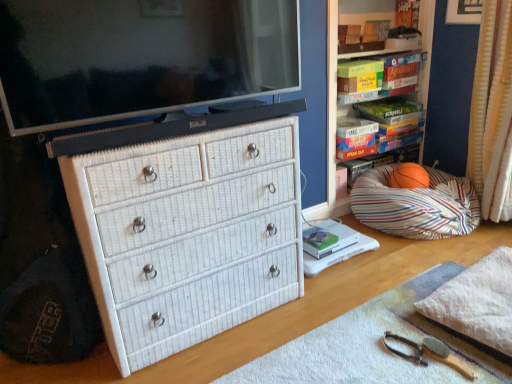
The height and width of the screenshot is (384, 512). What do you see at coordinates (361, 56) in the screenshot?
I see `striped fabric bean bag at right` at bounding box center [361, 56].

Where is `hardcover book at center, which appears as the first book when ordered from the bottom`? This screenshot has height=384, width=512. hardcover book at center, which appears as the first book when ordered from the bottom is located at coordinates (319, 238).

At what (x,y) coordinates should I click in order to perform the action: click on white fluffy blanket at lower right. Please return your answer as a coordinate pair (x, y). The width and height of the screenshot is (512, 384). Looking at the image, I should click on (478, 299).

The image size is (512, 384). Describe the element at coordinates (359, 82) in the screenshot. I see `hardcover book at upper right, positioned as the 1th book in top-to-bottom order` at that location.

What are the coordinates of `matte black flat-screen tv at upper center` in the screenshot? It's located at pos(139,57).

Is striped fabric bean bag at right not close to striped fabric bean bag at right?

No, striped fabric bean bag at right is not far away from striped fabric bean bag at right.

From a real-world perspective, is striped fabric bean bag at right below striped fabric bean bag at right?

Actually, striped fabric bean bag at right is physically above striped fabric bean bag at right in the real world.

Is striped fabric bean bag at right facing towards striped fabric bean bag at right?

Yes.

From the picture: Is striped fabric bean bag at right bigger than striped fabric bean bag at right?

Yes.

Does point (327, 244) come farther from viewer compared to point (466, 353)?

Yes, point (327, 244) is farther from viewer.

From the image's perspective, which is above, hardcover book at center, the first book from the front, or white wicker chest at center?

hardcover book at center, the first book from the front, appears higher in the image.

In terms of width, does hardcover book at center, which is the second book from top to bottom, look wider or thinner when compared to white wicker chest at center?

hardcover book at center, which is the second book from top to bottom, is thinner than white wicker chest at center.

Is hardcover book at center, the second book in the back-to-front sequence, taller than white wicker chest at center?

No, hardcover book at center, the second book in the back-to-front sequence, is not taller than white wicker chest at center.

From their relative heights in the image, would you say hardcover book at upper right, the 1th book when ordered from right to left, is taller or shorter than white wicker chest of drawers at left?

In the image, hardcover book at upper right, the 1th book when ordered from right to left, appears to be shorter than white wicker chest of drawers at left.

Does hardcover book at upper right, which appears as the second book when ordered from the bottom, have a smaller size compared to white wicker chest of drawers at left?

Yes.

Can white wicker chest of drawers at left be found inside hardcover book at upper right, acting as the 1th book starting from the back?

No, white wicker chest of drawers at left is not a part of hardcover book at upper right, acting as the 1th book starting from the back.

Considering the sizes of objects hardcover book at upper right, which appears as the second book when ordered from the bottom, and white wicker chest of drawers at left in the image provided, who is wider, hardcover book at upper right, which appears as the second book when ordered from the bottom, or white wicker chest of drawers at left?

white wicker chest of drawers at left.

The width and height of the screenshot is (512, 384). In order to click on chest of drawers above the striped fabric bean bag at right (from a real-world perspective) in this screenshot , I will do `click(188, 234)`.

Does point (291, 287) come behind point (465, 200)?

That is False.

Is white wicker chest of drawers at left aimed at striped fabric bean bag at right?

No, white wicker chest of drawers at left is not aimed at striped fabric bean bag at right.

Is white wicker chest of drawers at left further to camera compared to striped fabric bean bag at right?

No, white wicker chest of drawers at left is closer to the camera.

Is there a large distance between white fluffy blanket at lower right and striped fabric bean bag at right?

Actually, white fluffy blanket at lower right and striped fabric bean bag at right are a little close together.

In the scene shown: Could you tell me if white fluffy blanket at lower right is turned towards striped fabric bean bag at right?

No.

Does white fluffy blanket at lower right lie behind striped fabric bean bag at right?

No, white fluffy blanket at lower right is in front of striped fabric bean bag at right.

Between point (507, 341) and point (393, 216), which one is positioned behind?

The point (393, 216) is more distant.

In the image, is white wicker chest of drawers at left on the left side or the right side of white textured curtain at right?

white wicker chest of drawers at left is to the left of white textured curtain at right.

From a real-world perspective, is white wicker chest of drawers at left positioned over white textured curtain at right based on gravity?

Incorrect, from a real-world perspective, white wicker chest of drawers at left is lower than white textured curtain at right.

Is white wicker chest of drawers at left not within white textured curtain at right?

white wicker chest of drawers at left is positioned outside white textured curtain at right.

Which of these two, white wicker chest of drawers at left or white textured curtain at right, is smaller?

Smaller between the two is white textured curtain at right.

Locate an element on the screen. This screenshot has height=384, width=512. the 1st book to the left of the white fluffy blanket at lower right, starting your count from the anchor is located at coordinates (359, 82).

From the image's perspective, is hardcover book at upper right, the 2th book viewed from the left, positioned above or below white fluffy blanket at lower right?

hardcover book at upper right, the 2th book viewed from the left, is situated higher than white fluffy blanket at lower right in the image.

What are the coordinates of `cabinetry above the striped fabric bean bag at right (from a real-world perspective)` in the screenshot? It's located at (361, 56).

This screenshot has height=384, width=512. What are the coordinates of `plain located on the right of hardcover book at center, the first book from the front` in the screenshot? It's located at (374, 345).

When comparing their distances from wooden brush at lower right, does hardcover book at upper right, positioned as the 1th book in top-to-bottom order, or white wicker chest of drawers at left seem closer?

The object closer to wooden brush at lower right is white wicker chest of drawers at left.

Which object lies nearer to the anchor point striped fabric bean bag at right, white fluffy blanket at lower right or wooden brush at lower right?

white fluffy blanket at lower right lies closer to striped fabric bean bag at right than the other object.

Based on their spatial positions, is hardcover book at center, the second book in the back-to-front sequence, or hardcover book at upper right, positioned as the 1th book in top-to-bottom order, closer to wooden brush at lower right?

Among the two, hardcover book at center, the second book in the back-to-front sequence, is located nearer to wooden brush at lower right.

Which object lies further to the anchor point white wicker chest at center, matte black flat-screen tv at upper center or striped fabric bean bag at right?

striped fabric bean bag at right.

Considering their positions, is wooden brush at lower right positioned closer to hardcover book at center, the second book when ordered from right to left, than striped fabric bean bag at right?

striped fabric bean bag at right is closer to hardcover book at center, the second book when ordered from right to left.

From the image, which object appears to be farther from striped fabric bean bag at right, wooden brush at lower right or white fluffy blanket at lower right?

wooden brush at lower right is further to striped fabric bean bag at right.

Which object lies further to the anchor point white textured curtain at right, white wicker chest of drawers at left or wooden brush at lower right?

Among the two, white wicker chest of drawers at left is located further to white textured curtain at right.

Based on their spatial positions, is wooden brush at lower right or orange rubber basketball at right closer to white fluffy blanket at lower right?

wooden brush at lower right is closer to white fluffy blanket at lower right.

This screenshot has height=384, width=512. Find the location of `bean bag chair located between matte black flat-screen tv at upper center and white fluffy blanket at lower right in the left-right direction`. bean bag chair located between matte black flat-screen tv at upper center and white fluffy blanket at lower right in the left-right direction is located at coordinates (416, 205).

Identify the location of book between hardcover book at upper right, which is the 2th book from front to back, and wooden brush at lower right vertically. (319, 238).

Locate an element on the screen. This screenshot has width=512, height=384. television between white wicker chest at center and orange rubber basketball at right from front to back is located at coordinates (139, 57).

Find the location of a particular element. equipment between matte black flat-screen tv at upper center and white fluffy blanket at lower right is located at coordinates (430, 353).